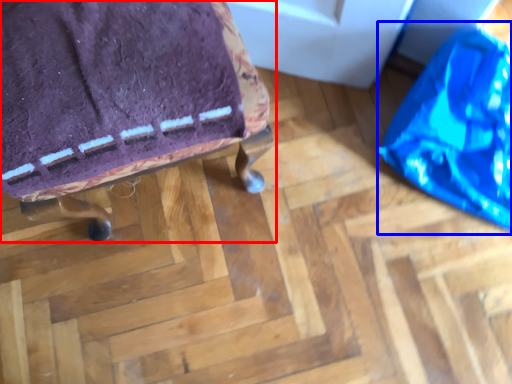
Question: Among these objects, which one is farthest to the camera, furniture (highlighted by a red box) or bean bag chair (highlighted by a blue box)?

Choices:
 (A) furniture
 (B) bean bag chair

Answer: (B)